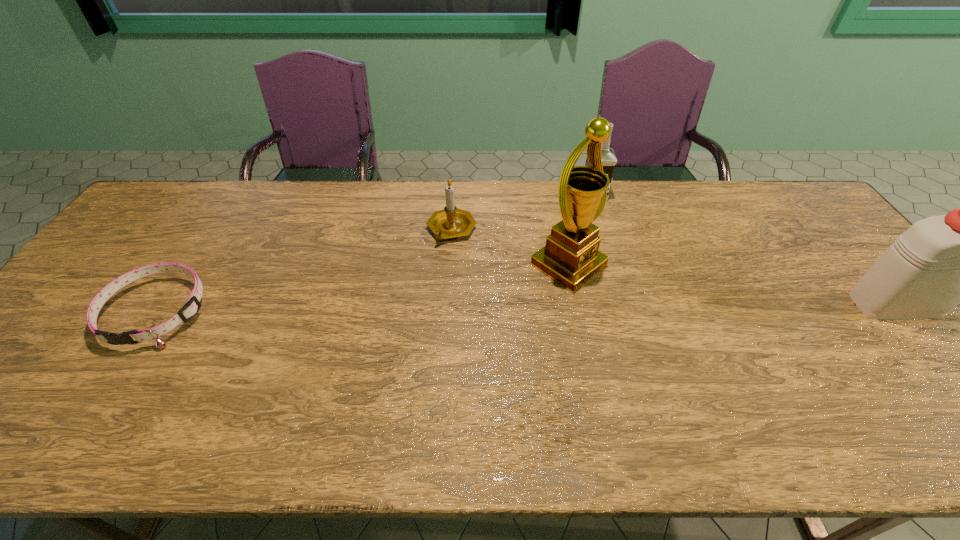
This screenshot has width=960, height=540. Identify the location of vodka positioned at the far edge. (609, 160).

The width and height of the screenshot is (960, 540). In order to click on object situated at the left edge in this screenshot , I will do `click(189, 310)`.

Where is `object that is at the right edge`? object that is at the right edge is located at coordinates (940, 261).

This screenshot has width=960, height=540. Find the location of `vacant space at the far edge of the desktop`. vacant space at the far edge of the desktop is located at coordinates (360, 184).

Locate an element on the screen. The height and width of the screenshot is (540, 960). free space at the near edge of the desktop is located at coordinates (564, 376).

This screenshot has width=960, height=540. I want to click on vacant space at the left edge of the desktop, so click(x=102, y=311).

Find the location of `free space at the right edge of the desktop`. free space at the right edge of the desktop is located at coordinates (948, 367).

What are the coordinates of `free space at the far left corner` in the screenshot? It's located at coord(204,199).

In the image, there is a desktop. Where is `free space at the near left corner`? free space at the near left corner is located at coordinates (19, 392).

What are the coordinates of `free space at the far right corner of the desktop` in the screenshot? It's located at (801, 210).